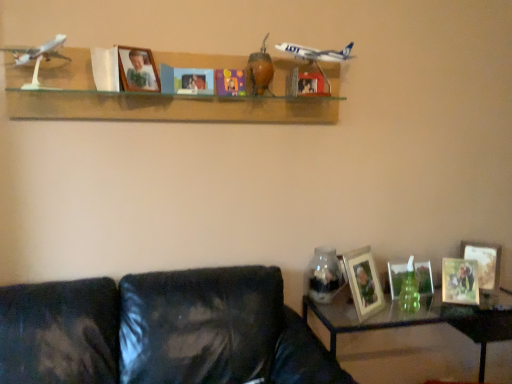
Question: Considering the relative sizes of matte wooden picture frame at center, the 2th picture frame when ordered from left to right, and wooden photo frame at center, which is the third picture frame in left-to-right order, in the image provided, is matte wooden picture frame at center, the 2th picture frame when ordered from left to right, bigger than wooden photo frame at center, which is the third picture frame in left-to-right order,?

Choices:
 (A) no
 (B) yes

Answer: (B)

Question: Does matte wooden picture frame at center, the 2th picture frame when ordered from left to right, contain wooden photo frame at center, arranged as the fifth picture frame when viewed from the right?

Choices:
 (A) no
 (B) yes

Answer: (A)

Question: Is matte wooden picture frame at center, the 6th picture frame viewed from the right, located outside wooden photo frame at center, which is the third picture frame in left-to-right order?

Choices:
 (A) yes
 (B) no

Answer: (A)

Question: Is matte wooden picture frame at center, the 2th picture frame when ordered from left to right, to the right of wooden photo frame at center, arranged as the fifth picture frame when viewed from the right, from the viewer's perspective?

Choices:
 (A) no
 (B) yes

Answer: (A)

Question: Is matte wooden picture frame at center, the 2th picture frame when ordered from left to right, positioned behind wooden photo frame at center, which is the third picture frame in left-to-right order?

Choices:
 (A) no
 (B) yes

Answer: (A)

Question: Is wooden photo frame at lower right, placed as the fourth picture frame when sorted from left to right, wider or thinner than wooden photo frame at lower right, which ranks as the sixth picture frame in left-to-right order?

Choices:
 (A) wide
 (B) thin

Answer: (A)

Question: Do you think wooden photo frame at lower right, placed as the fourth picture frame when sorted from left to right, is within wooden photo frame at lower right, the second picture frame viewed from the right, or outside of it?

Choices:
 (A) outside
 (B) inside

Answer: (A)

Question: Considering the positions of wooden photo frame at lower right, placed as the fourth picture frame when sorted from left to right, and wooden photo frame at lower right, which ranks as the sixth picture frame in left-to-right order, in the image, is wooden photo frame at lower right, placed as the fourth picture frame when sorted from left to right, bigger or smaller than wooden photo frame at lower right, which ranks as the sixth picture frame in left-to-right order,?

Choices:
 (A) big
 (B) small

Answer: (A)

Question: In terms of height, does wooden photo frame at lower right, placed as the fourth picture frame when sorted from left to right, look taller or shorter compared to wooden photo frame at lower right, the second picture frame viewed from the right?

Choices:
 (A) short
 (B) tall

Answer: (B)

Question: Is matte white picture frame at lower right, which is the fifth picture frame from left to right, inside the boundaries of clear glass table at lower right, or outside?

Choices:
 (A) outside
 (B) inside

Answer: (A)

Question: Is point (391, 263) closer or farther from the camera than point (394, 306)?

Choices:
 (A) farther
 (B) closer

Answer: (A)

Question: Considering the positions of matte white picture frame at lower right, which is the fifth picture frame from left to right, and clear glass table at lower right in the image, is matte white picture frame at lower right, which is the fifth picture frame from left to right, bigger or smaller than clear glass table at lower right?

Choices:
 (A) small
 (B) big

Answer: (A)

Question: In the image, is matte white picture frame at lower right, the third picture frame when ordered from right to left, on the left side or the right side of clear glass table at lower right?

Choices:
 (A) left
 (B) right

Answer: (A)

Question: Visually, is wooden photo frame at upper center, which is the 7th picture frame in right-to-left order, positioned to the left or to the right of wooden photo frame at lower right, placed as the fourth picture frame when sorted from left to right?

Choices:
 (A) left
 (B) right

Answer: (A)

Question: Does point (x=119, y=51) appear closer or farther from the camera than point (x=353, y=264)?

Choices:
 (A) closer
 (B) farther

Answer: (A)